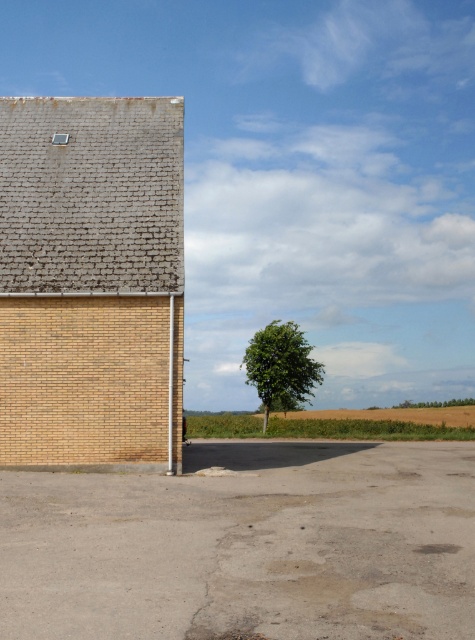
Is brick textured barn at upper left smaller than green leafy tree at center?

Yes, brick textured barn at upper left is smaller than green leafy tree at center.

The height and width of the screenshot is (640, 475). Describe the element at coordinates (92, 282) in the screenshot. I see `brick textured barn at upper left` at that location.

Which is behind, point (57, 349) or point (277, 378)?

The point (277, 378) is more distant.

In order to click on brick textured barn at upper left in this screenshot , I will do `click(92, 282)`.